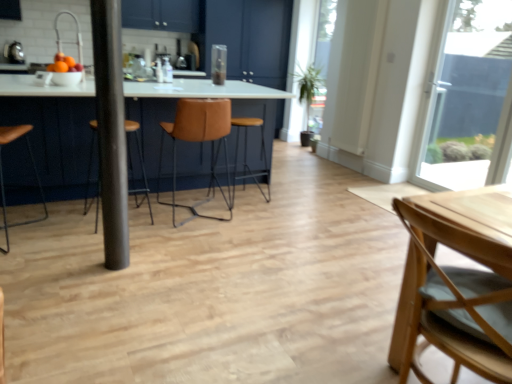
Locate an element on the screen. Image resolution: width=512 pixels, height=384 pixels. vacant space behind brown leather stool at left, the 4th chair positioned from the right is located at coordinates (46, 206).